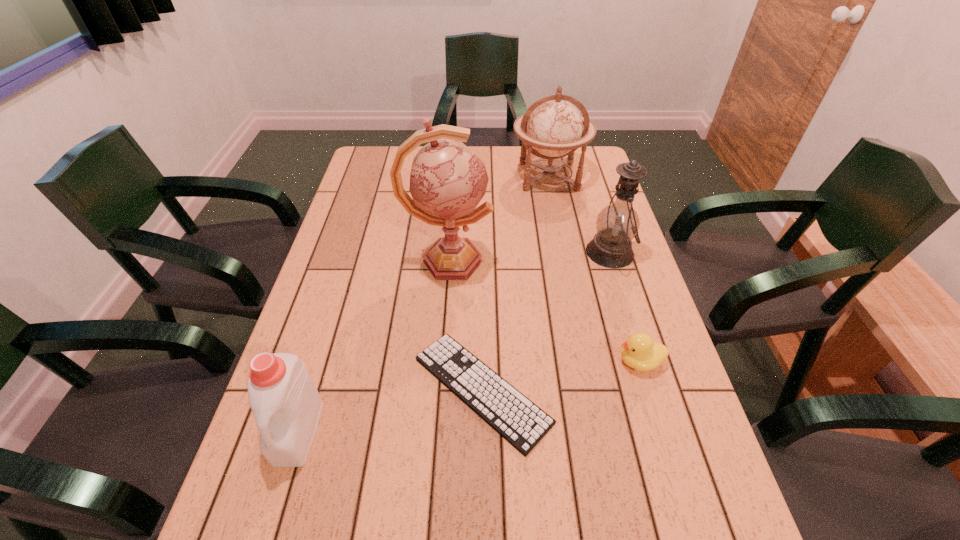
Locate an element on the screen. This screenshot has height=540, width=960. vacant region between the shortest object and the taller globe is located at coordinates (466, 325).

Locate an element on the screen. The height and width of the screenshot is (540, 960). unoccupied area between the oil lamp and the farther globe is located at coordinates [x=579, y=214].

Find the location of a particular element. unoccupied area between the fifth tallest object and the nearer globe is located at coordinates (544, 311).

This screenshot has width=960, height=540. Identify the location of object that is the third nearest to the detergent. point(640,352).

You are a GUI agent. You are given a task and a screenshot of the screen. Output one action in this format:
    pyautogui.click(x=<x>, y=<y>)
    Task: Click on the object that is the fifth closest one to the oil lamp
    The image size is (960, 540).
    Given the screenshot: What is the action you would take?
    pyautogui.click(x=285, y=402)

The height and width of the screenshot is (540, 960). What are the coordinates of `vacant space that satisfies the following two spatial constraints: 1. on the front-facing side of the tallest object; 2. on the right side of the shortest object` in the screenshot? It's located at (439, 389).

Where is `vacant area that satisfies the following two spatial constraints: 1. on the back side of the shortest object; 2. on the front-facing side of the taller globe`? vacant area that satisfies the following two spatial constraints: 1. on the back side of the shortest object; 2. on the front-facing side of the taller globe is located at coordinates (482, 261).

Locate an element on the screen. free space that satisfies the following two spatial constraints: 1. on the front-facing side of the left globe; 2. on the handle side of the fourth tallest object is located at coordinates (436, 431).

Locate an element on the screen. free spot that satisfies the following two spatial constraints: 1. on the front-facing side of the tallest object; 2. on the handle side of the leftmost object is located at coordinates (436, 431).

Where is `vacant area in the image that satisfies the following two spatial constraints: 1. on the beak of the fifth tallest object; 2. on the handle side of the detergent`? vacant area in the image that satisfies the following two spatial constraints: 1. on the beak of the fifth tallest object; 2. on the handle side of the detergent is located at coordinates (660, 431).